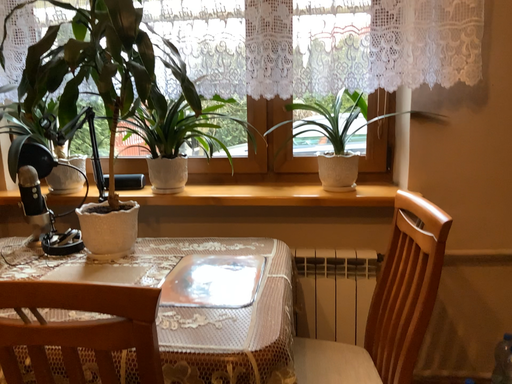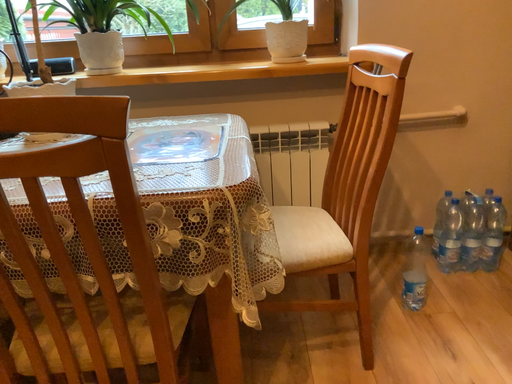
Question: Which way did the camera rotate in the video?

Choices:
 (A) rotated left
 (B) rotated right

Answer: (B)